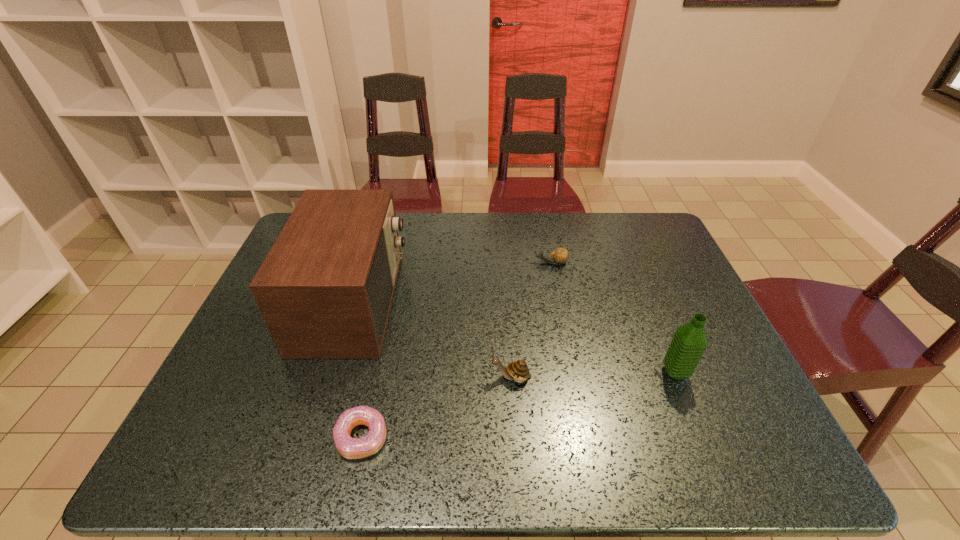
Where is `blank area located on the left of the fourth shortest object`? Image resolution: width=960 pixels, height=540 pixels. blank area located on the left of the fourth shortest object is located at coordinates (550, 373).

Locate an element on the screen. The width and height of the screenshot is (960, 540). vacant space situated 0.060m on the face of the nearer escargot is located at coordinates (464, 377).

Image resolution: width=960 pixels, height=540 pixels. I want to click on free spot located 0.100m on the face of the nearer escargot, so click(447, 377).

This screenshot has width=960, height=540. Find the location of `free space located 0.350m on the face of the nearer escargot`. free space located 0.350m on the face of the nearer escargot is located at coordinates (341, 377).

The height and width of the screenshot is (540, 960). Find the location of `vacant area located on the front-facing side of the second object from right to left`. vacant area located on the front-facing side of the second object from right to left is located at coordinates tap(427, 262).

The width and height of the screenshot is (960, 540). Find the location of `free space located 0.230m on the front-facing side of the second object from right to left`. free space located 0.230m on the front-facing side of the second object from right to left is located at coordinates (460, 262).

I want to click on vacant space located 0.190m on the front-facing side of the second object from right to left, so click(x=472, y=262).

Identify the location of free point located on the back of the doughnut. (378, 360).

Where is `object situated at the near edge`? The image size is (960, 540). object situated at the near edge is located at coordinates (350, 448).

I want to click on object positioned at the left edge, so click(x=325, y=289).